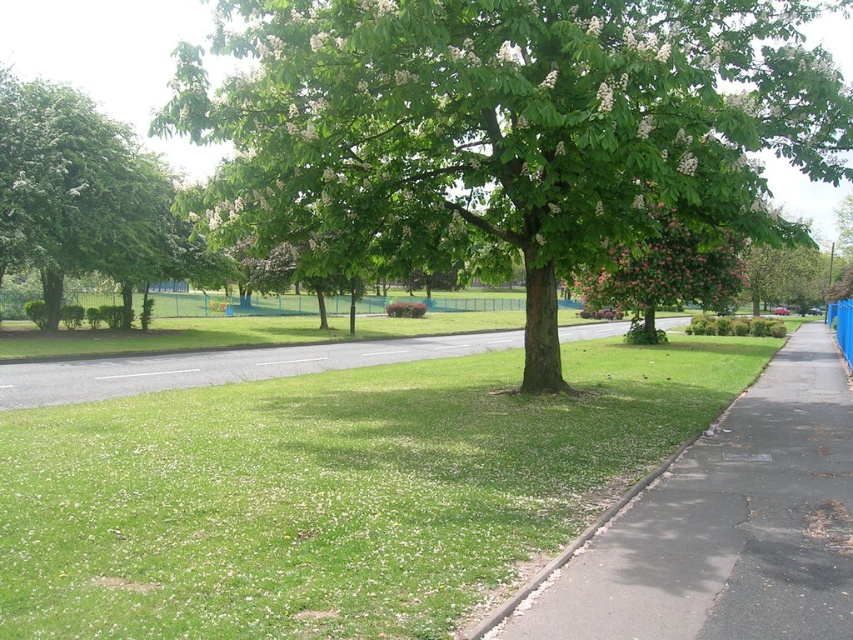
In the scene shown: Is green grass at center thinner than green leafy tree at center?

No.

Does green grass at center have a greater height compared to green leafy tree at center?

Incorrect, green grass at center's height is not larger of green leafy tree at center's.

Locate an element on the screen. Image resolution: width=853 pixels, height=640 pixels. green grass at center is located at coordinates (331, 492).

Is green leafy tree at center to the left of green asphalt at center from the viewer's perspective?

In fact, green leafy tree at center is to the right of green asphalt at center.

Where is `green leafy tree at center`? green leafy tree at center is located at coordinates (515, 120).

The width and height of the screenshot is (853, 640). I want to click on green leafy tree at center, so click(515, 120).

The width and height of the screenshot is (853, 640). Find the location of `green leafy tree at center`. green leafy tree at center is located at coordinates (515, 120).

Is point (712, 605) closer to camera compared to point (138, 385)?

Yes, point (712, 605) is closer to viewer.

Image resolution: width=853 pixels, height=640 pixels. I want to click on gray asphalt sidewalk at lower right, so coord(727,525).

The width and height of the screenshot is (853, 640). I want to click on gray asphalt sidewalk at lower right, so click(727, 525).